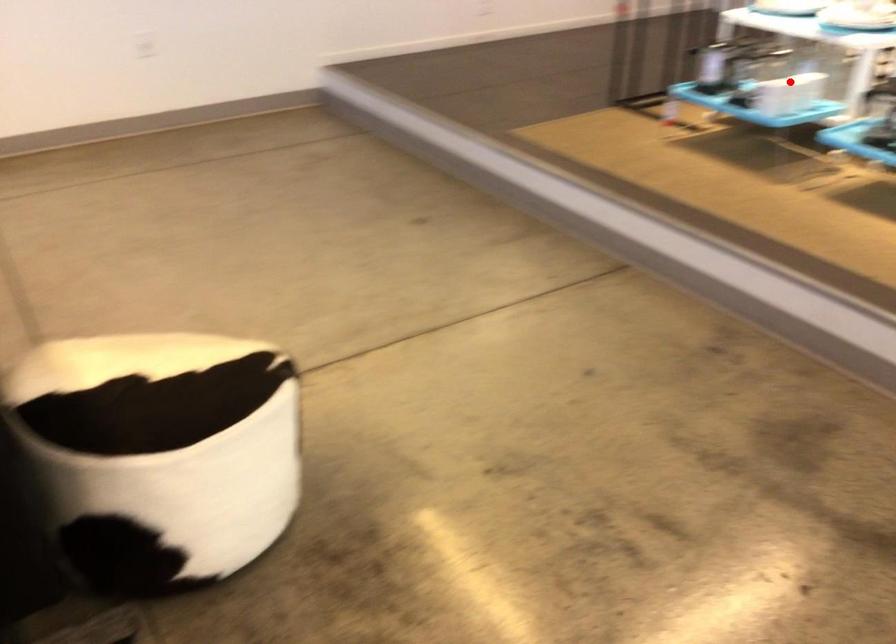
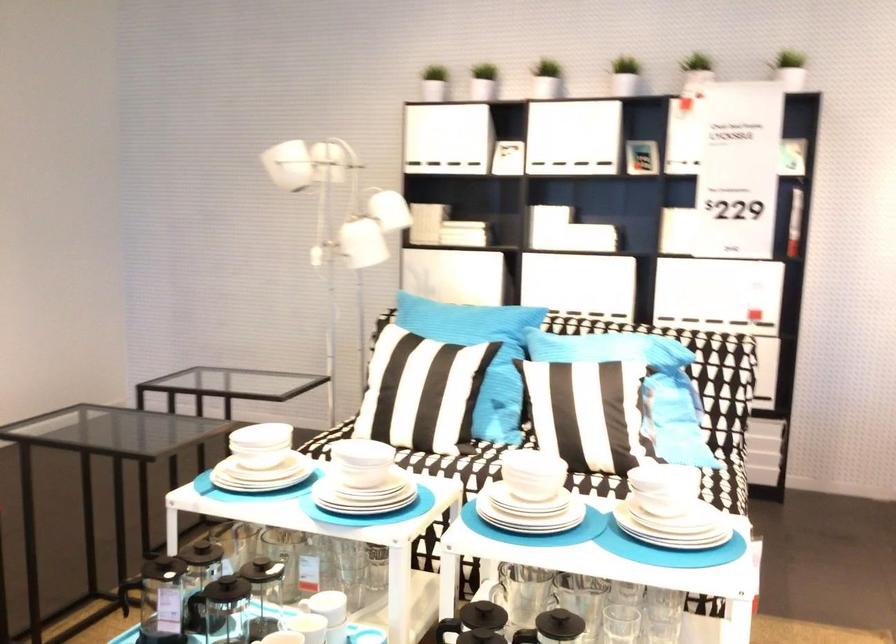
Question: I am providing you with two images of the same scene from different viewpoints. Given a red point in image1, look at the same physical point in image2. Is it:

Choices:
 (A) Closer to the viewpoint
 (B) Farther from the viewpoint

Answer: (A)